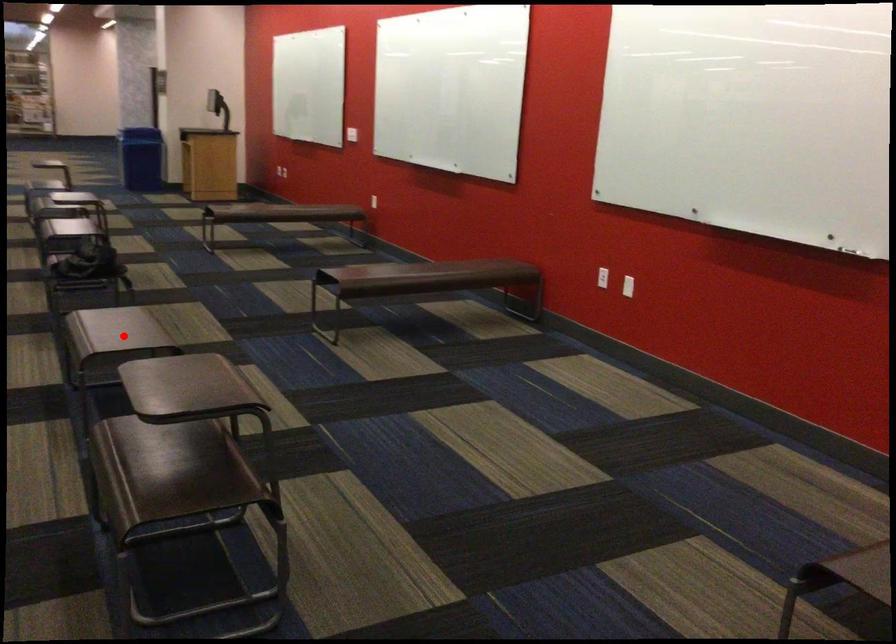
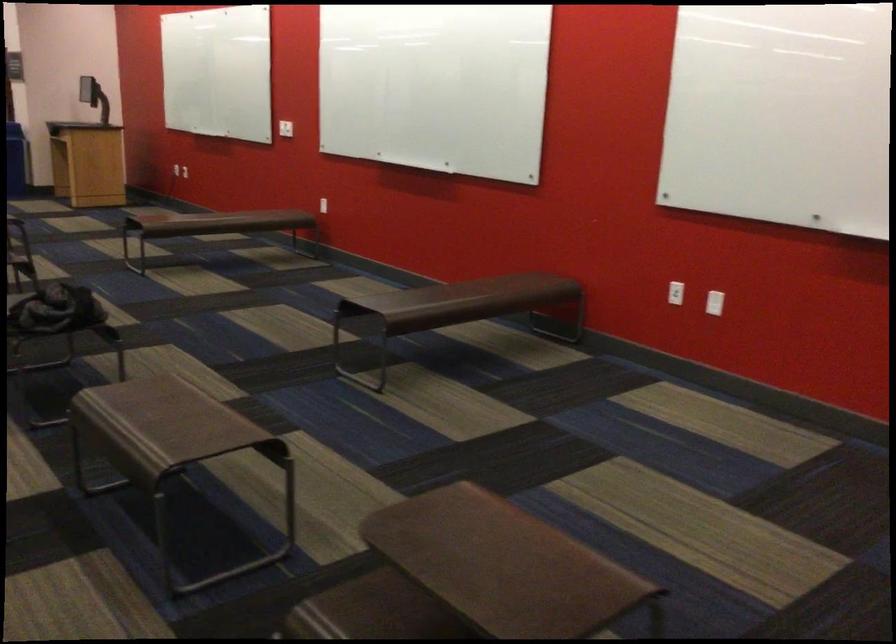
Where in the second image is the point corresponding to the highlighted location from the first image?

(170, 420)